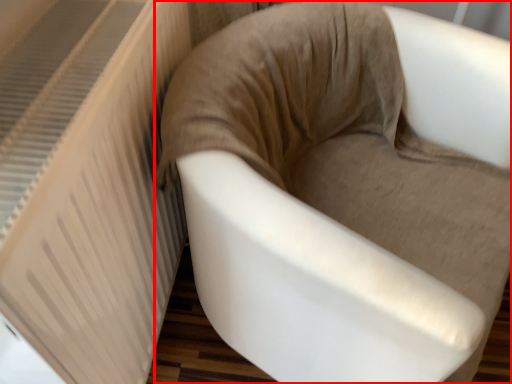
Question: From the image's perspective, considering the relative positions of chair (annotated by the red box) and radiator in the image provided, where is chair (annotated by the red box) located with respect to the staircase?

Choices:
 (A) below
 (B) above

Answer: (A)